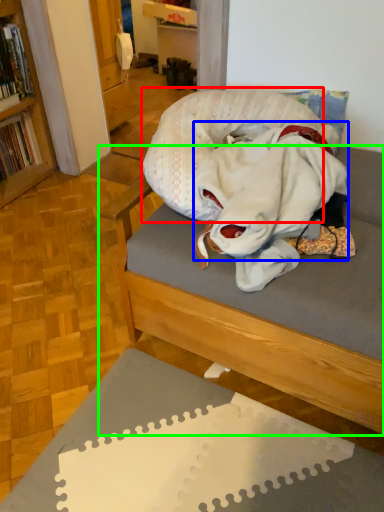
Question: Which object is the farthest from pillow (highlighted by a red box)? Choose among these: clothing (highlighted by a blue box) or studio couch (highlighted by a green box).

Choices:
 (A) clothing
 (B) studio couch

Answer: (B)